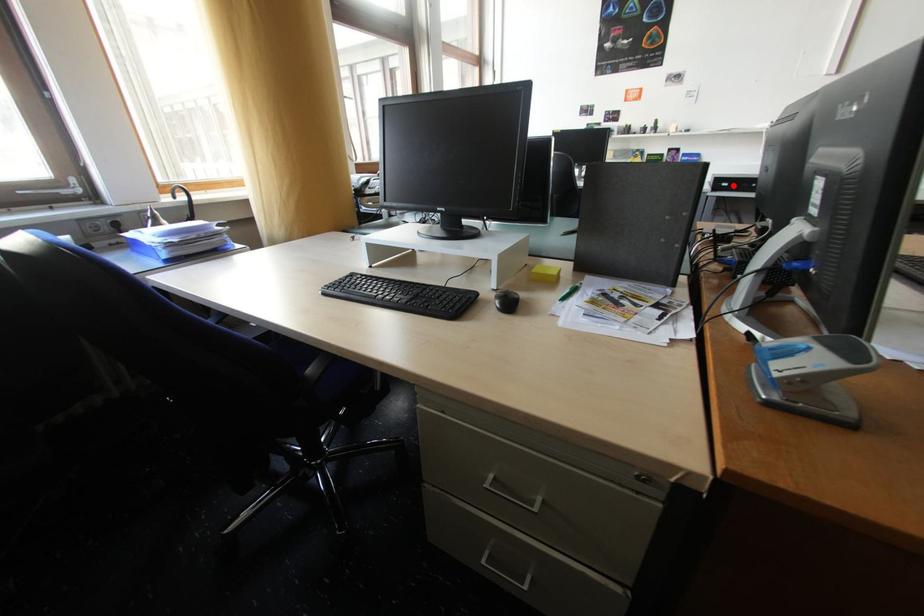
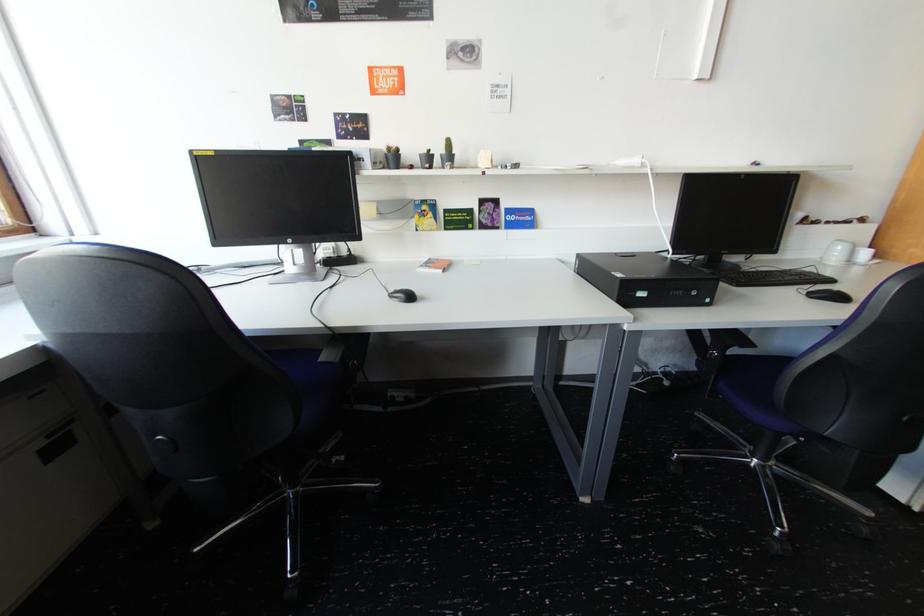
In the second image, find the point that corresponds to the highlighted location in the first image.

(650, 294)